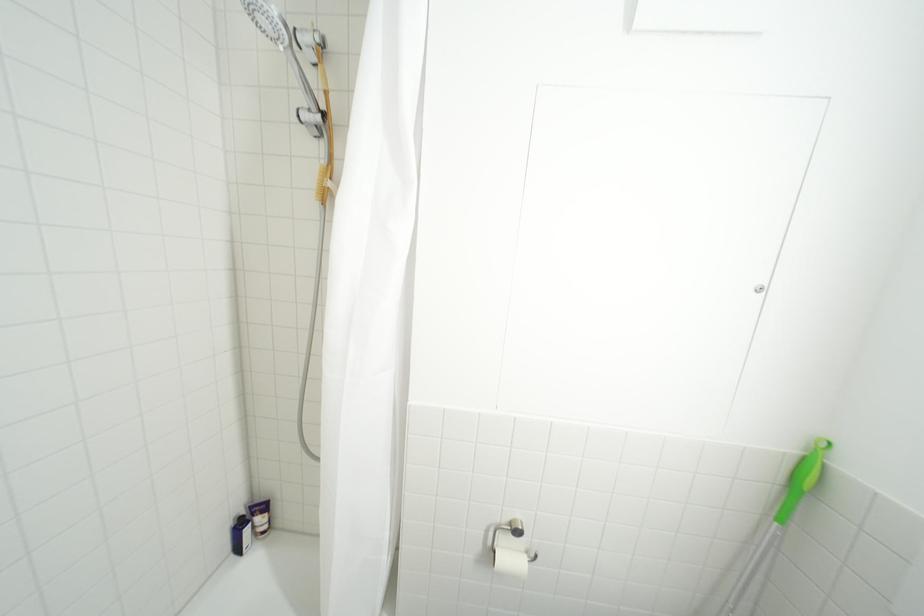
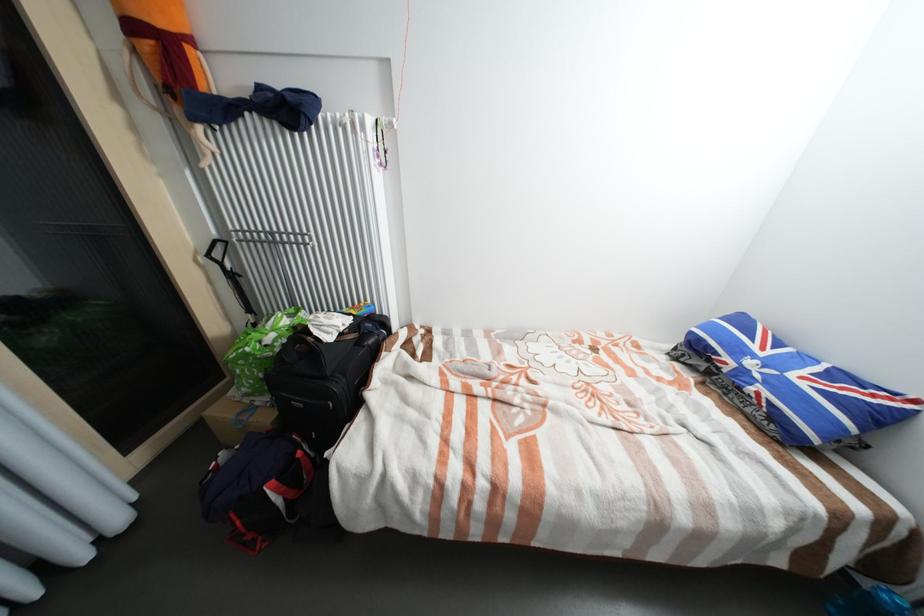
Question: The images are taken continuously from a first-person perspective. In which direction are you moving?

Choices:
 (A) Left
 (B) Right
 (C) Forward
 (D) Backward

Answer: (A)